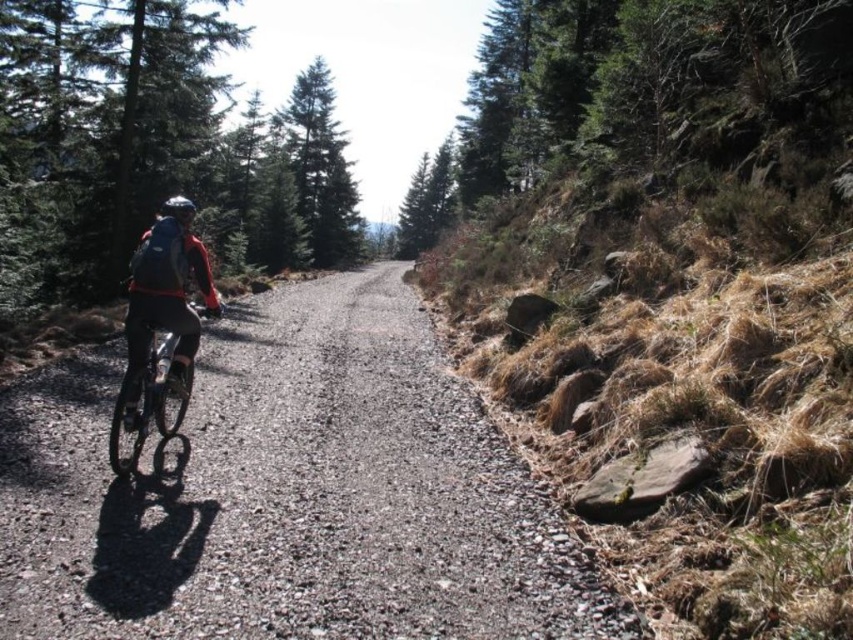
You are a cyclist planning to ride from the shiny metallic bicycle at left to the green matte evergreen tree at center. The path is narrow and has loose gravel. If your bicycle can safely navigate paths narrower than 2 meters, can you reach the tree without dismounting?

The distance between the shiny metallic bicycle at left and the green matte evergreen tree at center is 44.64 meters. Since the path is narrow but the question only mentions the distance between the two points, there is no information provided about the path width. Therefore, it is impossible to determine if the path is narrow enough for the bicycle to safely navigate without dismounting based on the given information.

You are a hiker planning to walk along the gray gravel path at center. There is a green textured tree at right overhead. Will the path be shaded by the tree?

The gray gravel path at center is positioned under the green textured tree at right, so yes, the path will be shaded by the tree.